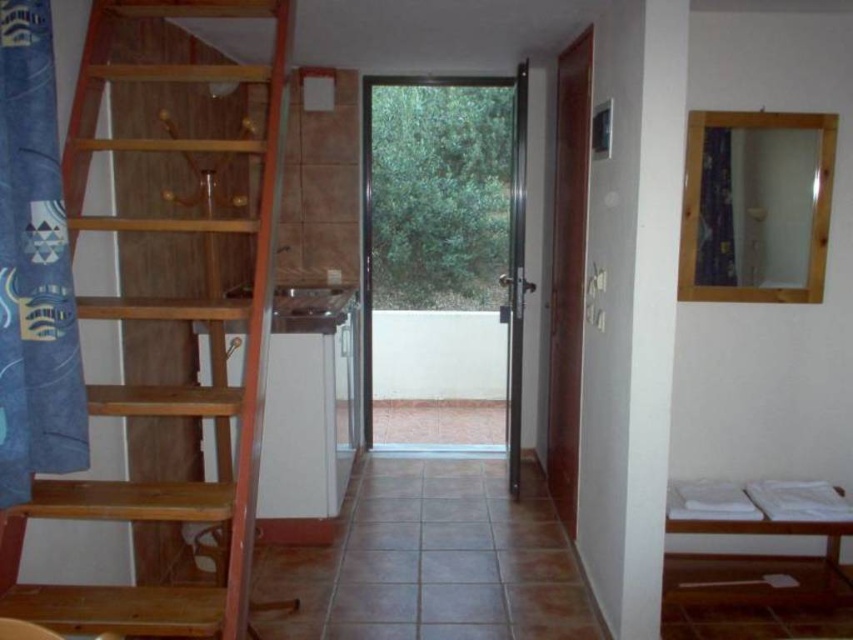
Who is higher up, wooden ladder at left or white wooden bunk bed at lower right?

wooden ladder at left is above.

Who is positioned more to the left, wooden ladder at left or white wooden bunk bed at lower right?

wooden ladder at left

Describe the element at coordinates (169, 314) in the screenshot. I see `wooden ladder at left` at that location.

At what (x,y) coordinates should I click in order to perform the action: click on wooden ladder at left. Please return your answer as a coordinate pair (x, y). The width and height of the screenshot is (853, 640). Looking at the image, I should click on (169, 314).